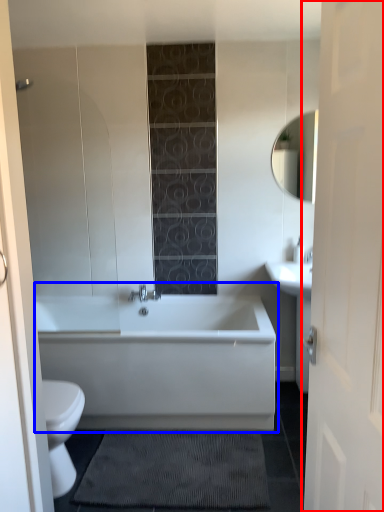
Question: Which of the following is the farthest to the observer, door (highlighted by a red box) or bathtub (highlighted by a blue box)?

Choices:
 (A) door
 (B) bathtub

Answer: (B)